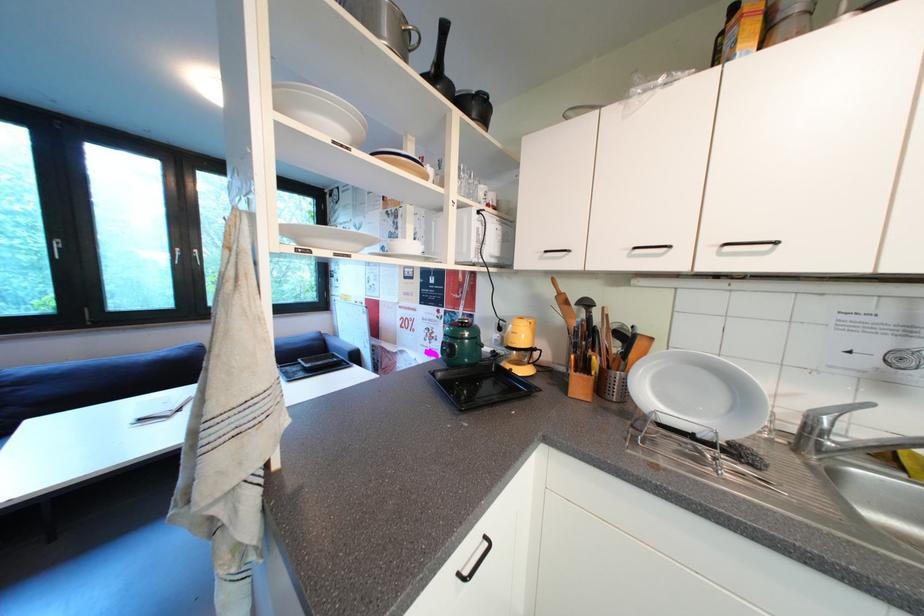
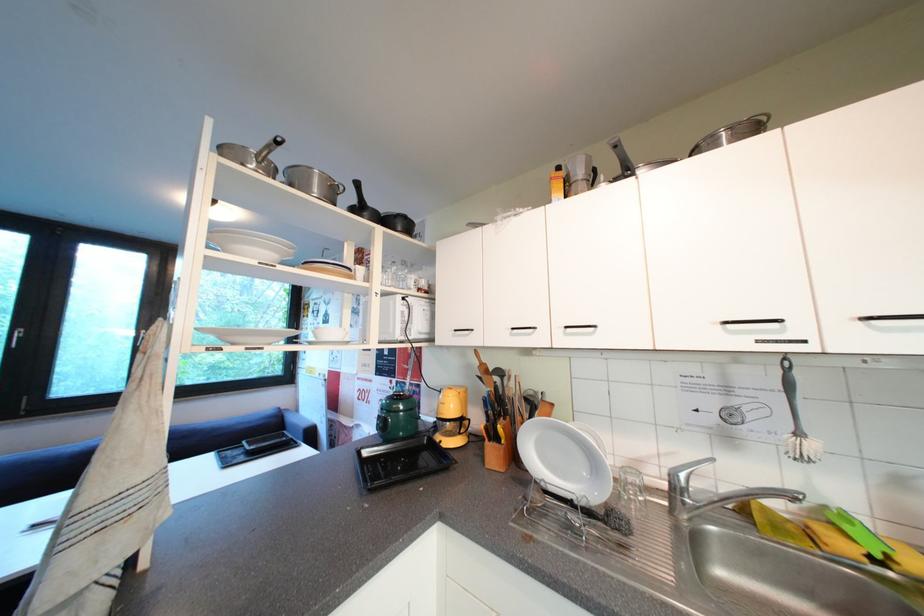
Question: The first image is from the beginning of the video and the second image is from the end. How did the camera likely rotate when shooting the video?

Choices:
 (A) Left
 (B) Right
 (C) Up
 (D) Down

Answer: (C)